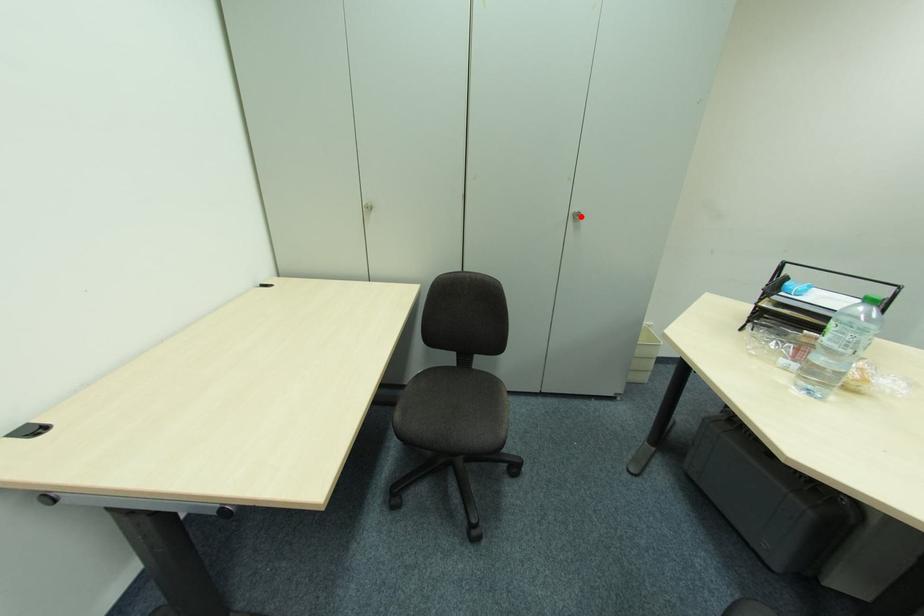
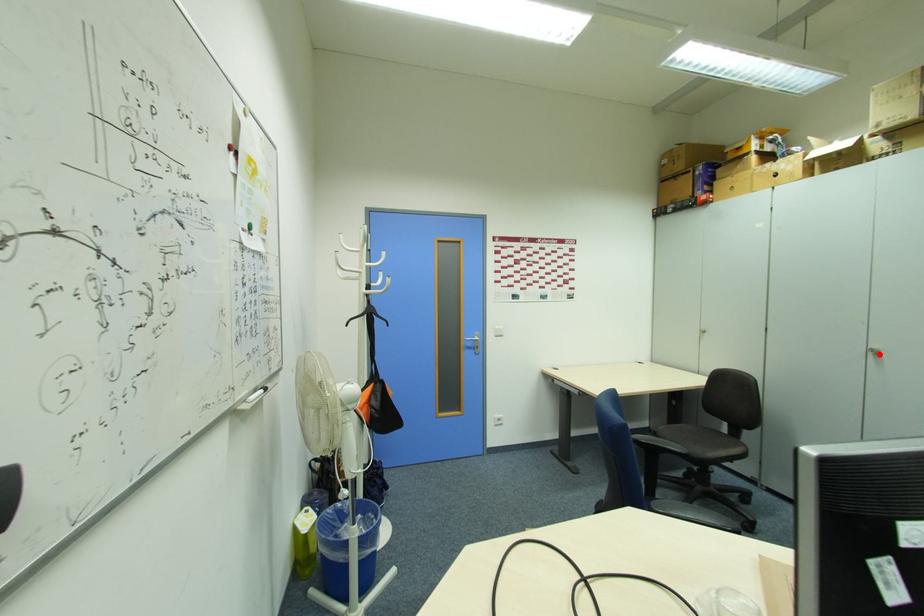
I am providing you with two images of the same scene from different viewpoints. A red point is marked on the first image and another point is marked on the second image. Is the red point in image1 aligned with the point shown in image2?

Yes